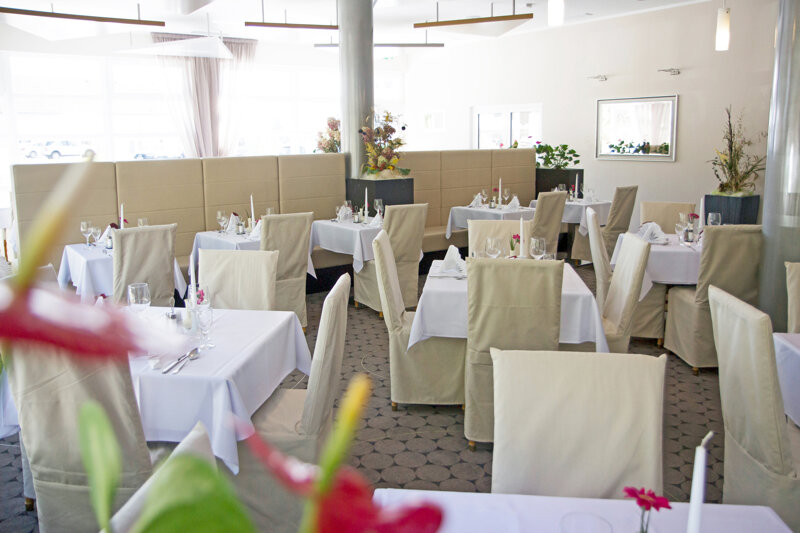
Where is `white napkins`? The width and height of the screenshot is (800, 533). white napkins is located at coordinates (448, 258), (372, 223), (257, 229), (106, 240), (157, 340), (665, 230), (518, 201), (477, 196).